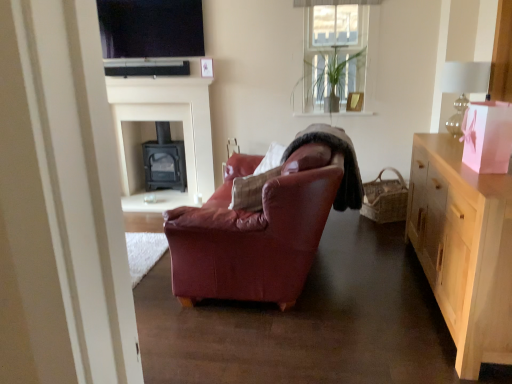
Question: Is matte black tv at upper center at the right side of woven brown picnic basket at right?

Choices:
 (A) yes
 (B) no

Answer: (B)

Question: Is matte black tv at upper center oriented towards woven brown picnic basket at right?

Choices:
 (A) no
 (B) yes

Answer: (A)

Question: Can you confirm if matte black tv at upper center is wider than woven brown picnic basket at right?

Choices:
 (A) no
 (B) yes

Answer: (A)

Question: From the image's perspective, does matte black tv at upper center appear higher than woven brown picnic basket at right?

Choices:
 (A) yes
 (B) no

Answer: (A)

Question: Is the surface of matte black tv at upper center in direct contact with woven brown picnic basket at right?

Choices:
 (A) yes
 (B) no

Answer: (B)

Question: Is point (367, 206) positioned closer to the camera than point (185, 122)?

Choices:
 (A) farther
 (B) closer

Answer: (B)

Question: Based on their positions, is woven brown picnic basket at right located to the left or right of black matte fireplace at center, acting as the 2th fireplace starting from the back?

Choices:
 (A) right
 (B) left

Answer: (A)

Question: Relative to black matte fireplace at center, acting as the 2th fireplace starting from the back, is woven brown picnic basket at right in front or behind?

Choices:
 (A) front
 (B) behind

Answer: (A)

Question: Looking at the image, does woven brown picnic basket at right seem bigger or smaller compared to black matte fireplace at center, acting as the 2th fireplace starting from the back?

Choices:
 (A) big
 (B) small

Answer: (B)

Question: Which is correct: matte black tv at upper center is inside woven brown picnic basket at right, or outside of it?

Choices:
 (A) inside
 (B) outside

Answer: (B)

Question: Looking at their shapes, would you say matte black tv at upper center is wider or thinner than woven brown picnic basket at right?

Choices:
 (A) thin
 (B) wide

Answer: (A)

Question: From the image's perspective, is matte black tv at upper center above or below woven brown picnic basket at right?

Choices:
 (A) above
 (B) below

Answer: (A)

Question: Is point (130, 84) positioned closer to the camera than point (374, 203)?

Choices:
 (A) closer
 (B) farther

Answer: (B)

Question: Visually, is woven brown picnic basket at right positioned to the left or to the right of light wood cabinet at right?

Choices:
 (A) right
 (B) left

Answer: (B)

Question: Is woven brown picnic basket at right wider or thinner than light wood cabinet at right?

Choices:
 (A) thin
 (B) wide

Answer: (A)